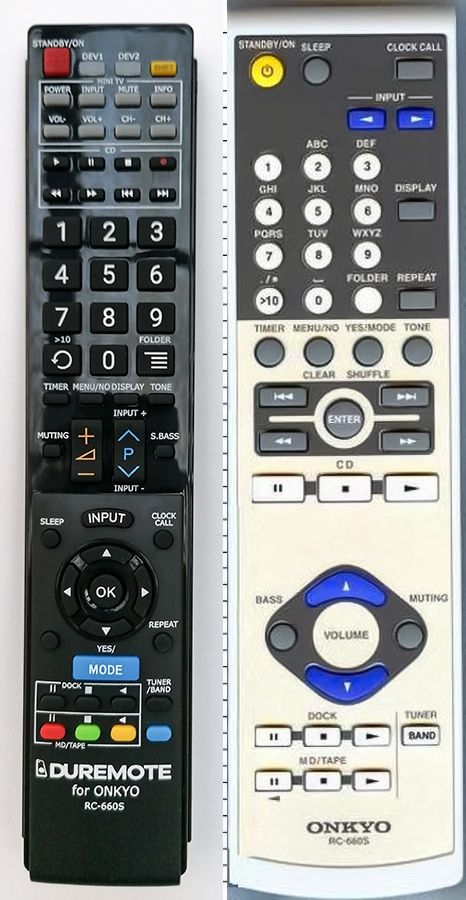
You are a GUI agent. You are given a task and a screenshot of the screen. Output one action in this format:
    pyautogui.click(x=<x>, y=<y>)
    Task: Click on the white remote control
    
    Given the screenshot: What is the action you would take?
    pyautogui.click(x=282, y=843)